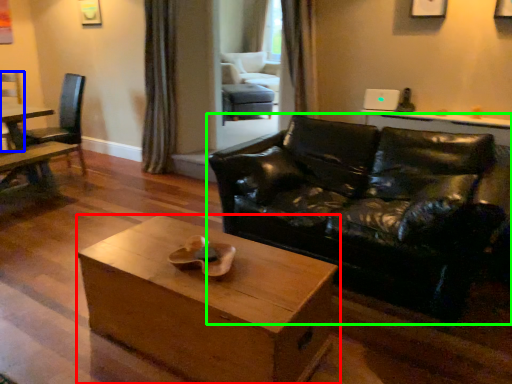
Question: Which object is positioned closest to coffee table (highlighted by a red box)? Select from chair (highlighted by a blue box) and studio couch (highlighted by a green box).

Choices:
 (A) chair
 (B) studio couch

Answer: (B)